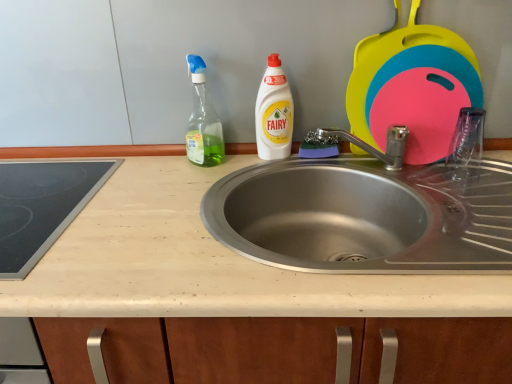
The height and width of the screenshot is (384, 512). Identify the location of vacant space that is in between green glass spray bottle at upper left, which is the 2th cleaning product in right-to-left order, and white plastic bottle at center, acting as the 1th cleaning product starting from the right. (242, 161).